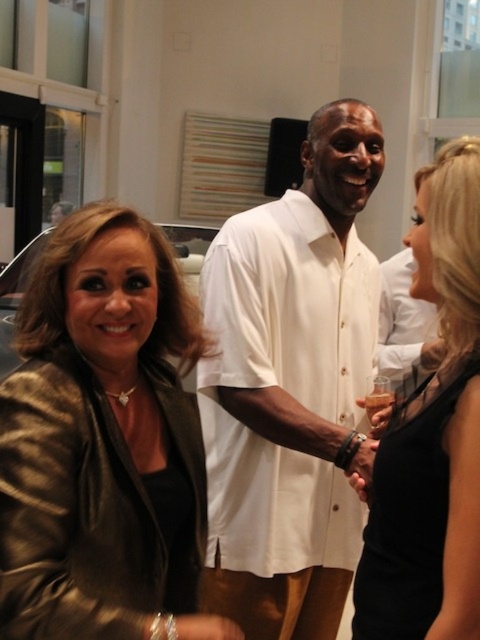
In the scene shown: Who is taller, metallic gold jacket at center or white cotton shirt at center?

white cotton shirt at center

Is metallic gold jacket at center above white cotton shirt at center?

Incorrect, metallic gold jacket at center is not positioned above white cotton shirt at center.

Does point (71, 624) come in front of point (309, 337)?

Yes, point (71, 624) is closer to viewer.

I want to click on metallic gold jacket at center, so click(103, 442).

Can you confirm if metallic gold jacket at center is shorter than black satin dress at center?

Correct, metallic gold jacket at center is not as tall as black satin dress at center.

I want to click on metallic gold jacket at center, so click(103, 442).

Is white cotton shirt at center below black satin dress at center?

Incorrect, white cotton shirt at center is not positioned below black satin dress at center.

At what (x,y) coordinates should I click in order to perform the action: click on white cotton shirt at center. Please return your answer as a coordinate pair (x, y). This screenshot has height=640, width=480. Looking at the image, I should click on (290, 388).